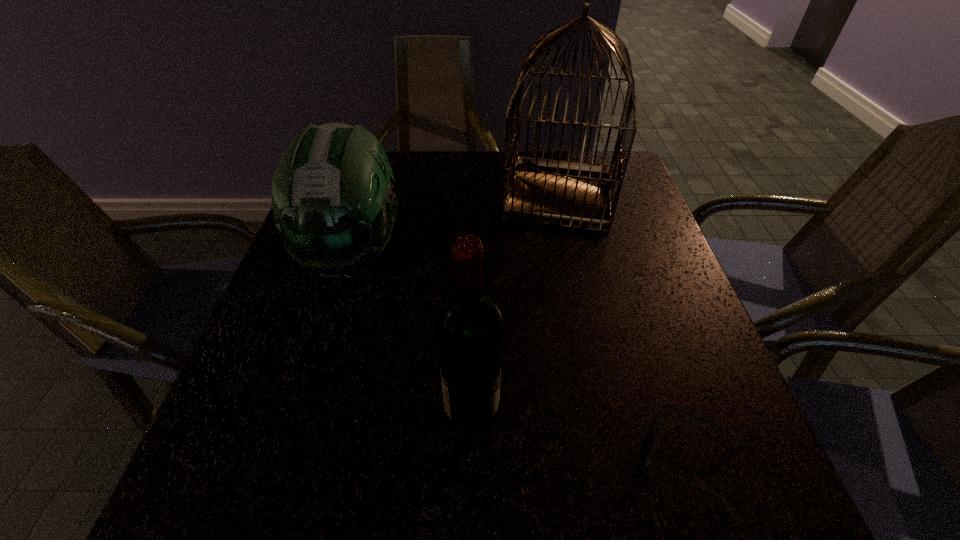
Where is `the tallest object`? The width and height of the screenshot is (960, 540). the tallest object is located at coordinates coord(573,194).

This screenshot has width=960, height=540. I want to click on the second object from left to right, so click(x=469, y=325).

This screenshot has width=960, height=540. Find the location of `the second tallest object`. the second tallest object is located at coordinates (469, 325).

Locate an element on the screen. This screenshot has width=960, height=540. football helmet is located at coordinates (334, 206).

The image size is (960, 540). Find the location of `the third tallest object`. the third tallest object is located at coordinates coord(334,206).

I want to click on the shortest object, so click(659, 420).

At what (x,y) coordinates should I click in order to perform the action: click on vacant space located on the front of the birdcage. Please return your answer as a coordinate pair (x, y). The height and width of the screenshot is (540, 960). Looking at the image, I should click on (578, 280).

Identify the location of free space located on the front and back of the second tallest object. (613, 409).

Locate an element on the screen. vacant space positioned on the visor of the leftmost object is located at coordinates (324, 348).

Where is `vacant space situated 0.230m on the lenses of the sunglasses`? This screenshot has height=540, width=960. vacant space situated 0.230m on the lenses of the sunglasses is located at coordinates (487, 458).